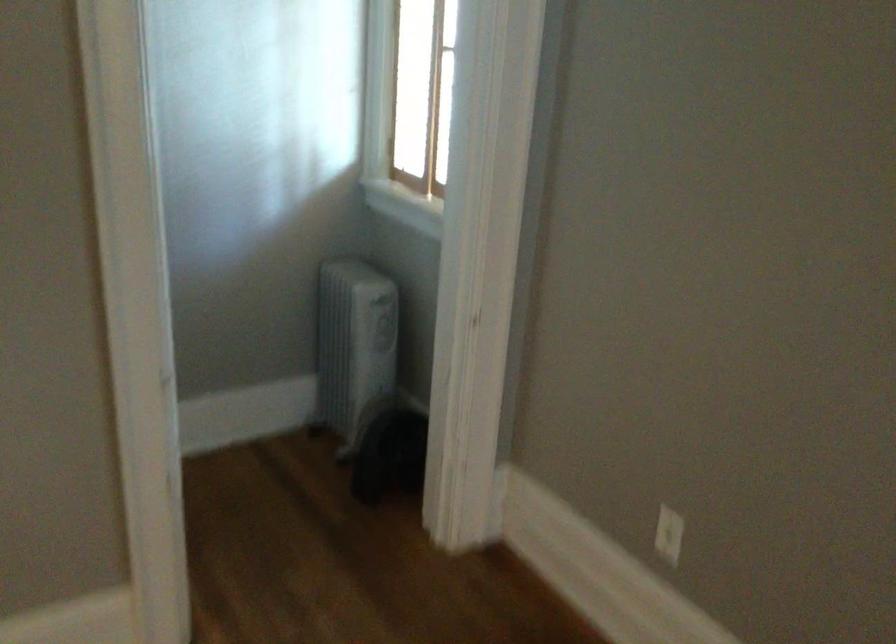
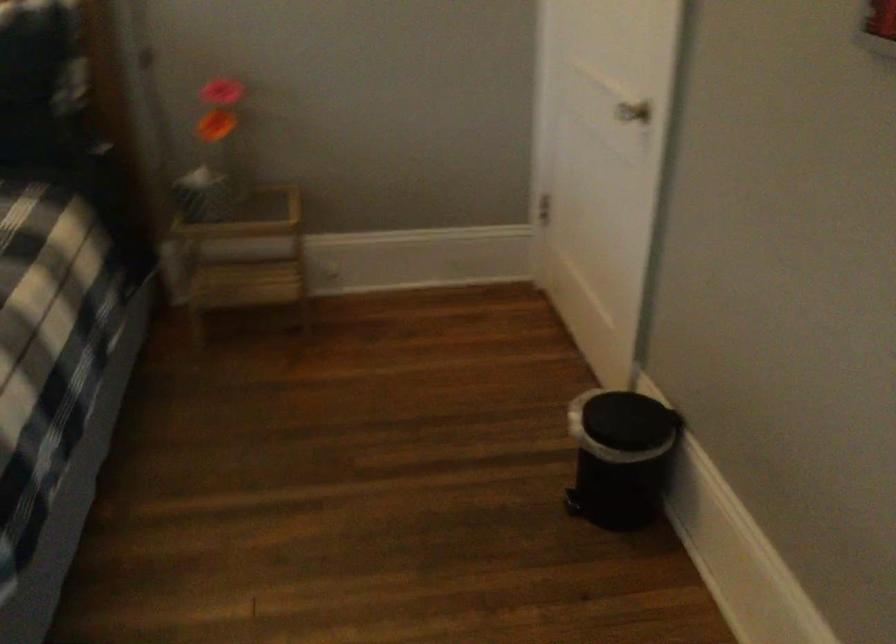
Based on the continuous images, in which direction is the camera rotating?

The rotation direction of the camera is left-down.